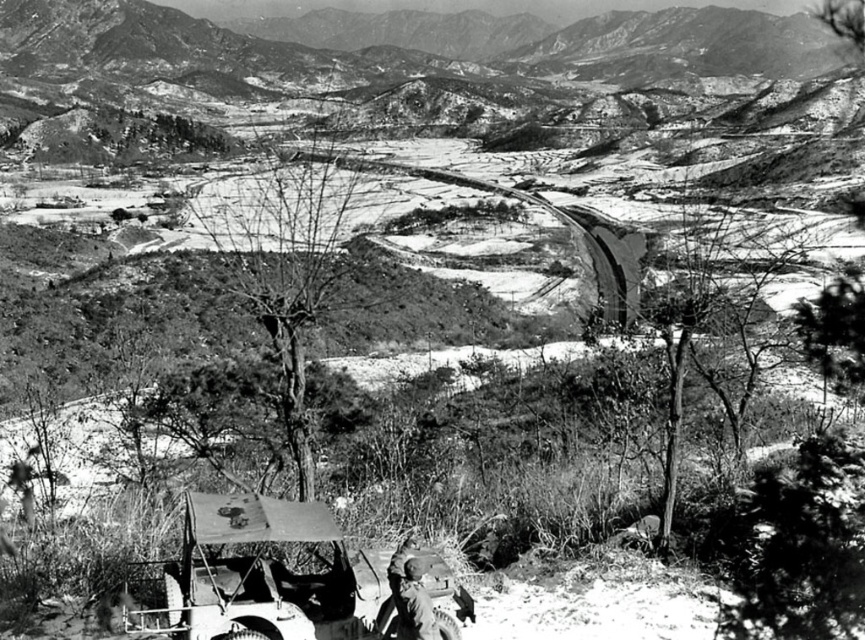
In the scene shown: Measure the distance between point [452,627] and camera.

Point [452,627] and camera are 10.47 meters apart from each other.

Describe the element at coordinates (260, 577) in the screenshot. I see `metallic matte jeep at lower left` at that location.

Is point (210, 627) positioned in front of point (399, 572)?

That is True.

This screenshot has width=865, height=640. Find the location of `metallic matte jeep at lower left`. metallic matte jeep at lower left is located at coordinates (260, 577).